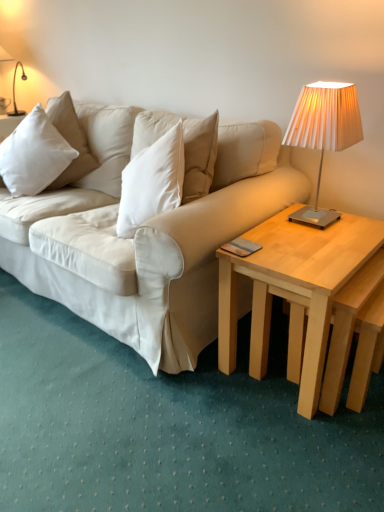
This screenshot has height=512, width=384. What are the coordinates of `blank area to the left of light wood/natural wood coffee table at right` in the screenshot? It's located at (187, 399).